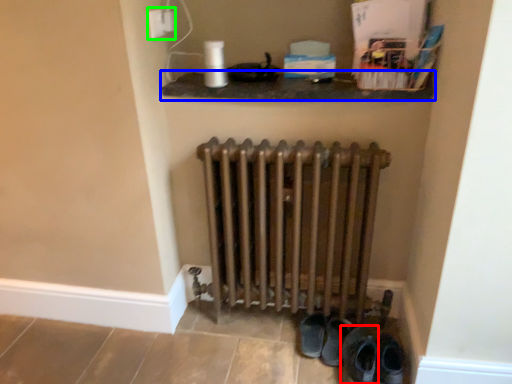
Question: Based on their relative distances, which object is farther from footwear (highlighted by a red box)? Choose from shelf (highlighted by a blue box) and electric outlet (highlighted by a green box).

Choices:
 (A) shelf
 (B) electric outlet

Answer: (B)